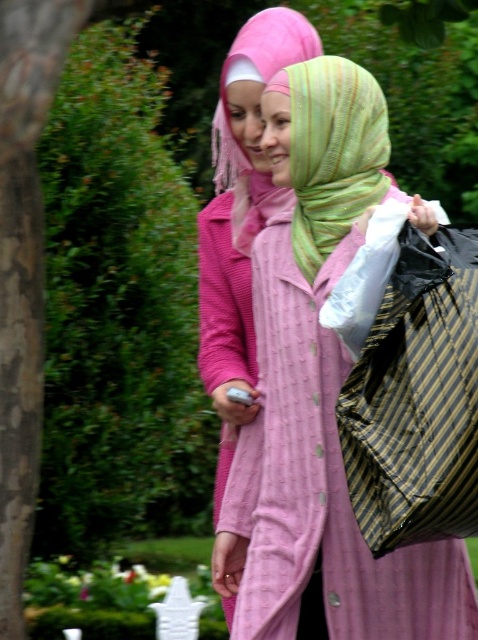
Does striped fabric bag at right have a lesser height compared to green striped scarf at center?

No, striped fabric bag at right is not shorter than green striped scarf at center.

This screenshot has height=640, width=478. What do you see at coordinates (416, 397) in the screenshot? I see `striped fabric bag at right` at bounding box center [416, 397].

This screenshot has width=478, height=640. In order to click on striped fabric bag at right in this screenshot , I will do `click(416, 397)`.

Can you confirm if matte pink coat at center is wider than green striped scarf at center?

Indeed, matte pink coat at center has a greater width compared to green striped scarf at center.

What do you see at coordinates (321, 388) in the screenshot? I see `matte pink coat at center` at bounding box center [321, 388].

The height and width of the screenshot is (640, 478). In order to click on matte pink coat at center in this screenshot , I will do `click(321, 388)`.

Is matte pink coat at center closer to the viewer compared to striped fabric bag at right?

No, it is behind striped fabric bag at right.

Is matte pink coat at center smaller than striped fabric bag at right?

No.

Describe the element at coordinates (321, 388) in the screenshot. This screenshot has height=640, width=478. I see `matte pink coat at center` at that location.

Locate an element on the screen. This screenshot has height=640, width=478. matte pink coat at center is located at coordinates [321, 388].